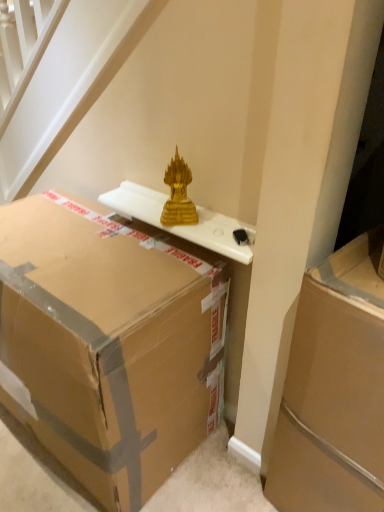
Question: Is brown cardboard box at center, positioned as the 1th box in left-to-right order, taller or shorter than gold glass sculpture at upper center?

Choices:
 (A) short
 (B) tall

Answer: (B)

Question: Looking at their shapes, would you say brown cardboard box at center, positioned as the 1th box in left-to-right order, is wider or thinner than gold glass sculpture at upper center?

Choices:
 (A) wide
 (B) thin

Answer: (A)

Question: Which of these objects is positioned farthest from the brown cardboard box at center, which appears as the second box when viewed from the right?

Choices:
 (A) white glossy table at upper center
 (B) gold glass sculpture at upper center
 (C) brown cardboard box at right, arranged as the 1th box when viewed from the right

Answer: (C)

Question: Estimate the real-world distances between objects in this image. Which object is closer to the gold glass sculpture at upper center?

Choices:
 (A) brown cardboard box at center, which appears as the second box when viewed from the right
 (B) brown cardboard box at right, which is the second box from left to right
 (C) white glossy table at upper center

Answer: (C)